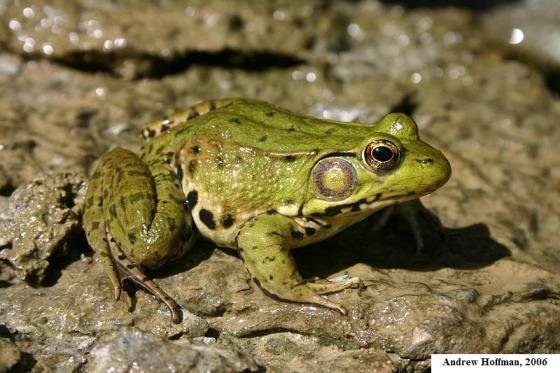
This screenshot has height=373, width=560. In order to click on right front leg in this screenshot , I will do (270, 263).